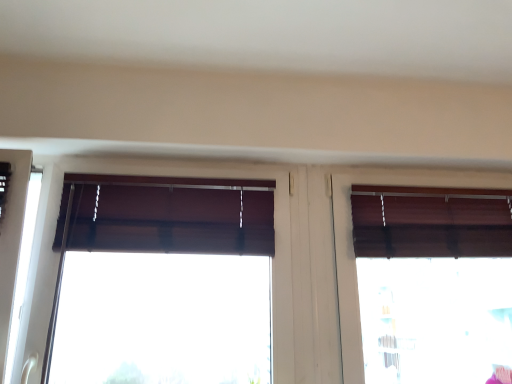
This screenshot has width=512, height=384. What do you see at coordinates (433, 282) in the screenshot?
I see `brown wooden blinds at right, which is the second window in left-to-right order` at bounding box center [433, 282].

Locate an element on the screen. The width and height of the screenshot is (512, 384). brown wooden blinds at right, which is the second window in left-to-right order is located at coordinates (433, 282).

The height and width of the screenshot is (384, 512). I want to click on brown fabric window at center, which is the 2th window in right-to-left order, so click(166, 215).

Image resolution: width=512 pixels, height=384 pixels. Describe the element at coordinates (166, 215) in the screenshot. I see `brown fabric window at center, which is the 2th window in right-to-left order` at that location.

Measure the distance between brown fabric window at center, which ranks as the first window in left-to-right order, and camera.

1.39 meters.

This screenshot has width=512, height=384. Identify the location of brown wooden blinds at right, which is the second window in left-to-right order. (433, 282).

Based on their positions, is brown wooden blinds at right, which is the 1th window from right to left, located to the left or right of brown fabric window at center, which ranks as the first window in left-to-right order?

brown wooden blinds at right, which is the 1th window from right to left, is positioned on brown fabric window at center, which ranks as the first window in left-to-right order,'s right side.

Does brown wooden blinds at right, which is the 1th window from right to left, lie in front of brown fabric window at center, which ranks as the first window in left-to-right order?

No.

Between point (426, 372) and point (88, 237), which one is positioned in front?

The point (88, 237) is closer.

From the image's perspective, is brown wooden blinds at right, which is the second window in left-to-right order, located beneath brown fabric window at center, which ranks as the first window in left-to-right order?

Yes, from the image's perspective, brown wooden blinds at right, which is the second window in left-to-right order, is beneath brown fabric window at center, which ranks as the first window in left-to-right order.

From a real-world perspective, is brown wooden blinds at right, which is the 1th window from right to left, over brown fabric window at center, which ranks as the first window in left-to-right order?

Incorrect, from a real-world perspective, brown wooden blinds at right, which is the 1th window from right to left, is lower than brown fabric window at center, which ranks as the first window in left-to-right order.

Which of these two, brown wooden blinds at right, which is the second window in left-to-right order, or brown fabric window at center, which ranks as the first window in left-to-right order, is thinner?

With smaller width is brown fabric window at center, which ranks as the first window in left-to-right order.

Considering the sizes of objects brown wooden blinds at right, which is the 1th window from right to left, and brown fabric window at center, which is the 2th window in right-to-left order, in the image provided, who is taller, brown wooden blinds at right, which is the 1th window from right to left, or brown fabric window at center, which is the 2th window in right-to-left order,?

brown wooden blinds at right, which is the 1th window from right to left.

Which of these two, brown wooden blinds at right, which is the second window in left-to-right order, or brown fabric window at center, which ranks as the first window in left-to-right order, is smaller?

brown wooden blinds at right, which is the second window in left-to-right order, is smaller.

Is brown wooden blinds at right, which is the 1th window from right to left, inside or outside of brown fabric window at center, which ranks as the first window in left-to-right order?

The correct answer is: outside.

Would you consider brown wooden blinds at right, which is the 1th window from right to left, to be distant from brown fabric window at center, which is the 2th window in right-to-left order?

That's not correct — brown wooden blinds at right, which is the 1th window from right to left, is a little close to brown fabric window at center, which is the 2th window in right-to-left order.

Is brown fabric window at center, which is the 2th window in right-to-left order, at the back of brown wooden blinds at right, which is the second window in left-to-right order?

That's not correct — brown wooden blinds at right, which is the second window in left-to-right order, is not looking away from brown fabric window at center, which is the 2th window in right-to-left order.

Can you tell me how much brown wooden blinds at right, which is the second window in left-to-right order, and brown fabric window at center, which ranks as the first window in left-to-right order, differ in facing direction?

There is a 0.00117-degree angle between the facing directions of brown wooden blinds at right, which is the second window in left-to-right order, and brown fabric window at center, which ranks as the first window in left-to-right order.

How distant is brown wooden blinds at right, which is the 1th window from right to left, from brown fabric window at center, which is the 2th window in right-to-left order?

26.45 inches.

The height and width of the screenshot is (384, 512). What are the coordinates of `window in front of the brown wooden blinds at right, which is the second window in left-to-right order` in the screenshot? It's located at (166, 215).

Based on their positions, is brown fabric window at center, which ranks as the first window in left-to-right order, located to the left or right of brown wooden blinds at right, which is the second window in left-to-right order?

brown fabric window at center, which ranks as the first window in left-to-right order, is to the left of brown wooden blinds at right, which is the second window in left-to-right order.

Does brown fabric window at center, which ranks as the first window in left-to-right order, lie behind brown wooden blinds at right, which is the second window in left-to-right order?

No, brown fabric window at center, which ranks as the first window in left-to-right order, is closer to the viewer.

Which is closer, (48, 347) or (444, 379)?

Point (48, 347) is closer to the camera than point (444, 379).

From the image's perspective, does brown fabric window at center, which ranks as the first window in left-to-right order, appear lower than brown wooden blinds at right, which is the second window in left-to-right order?

No, from the image's perspective, brown fabric window at center, which ranks as the first window in left-to-right order, is not beneath brown wooden blinds at right, which is the second window in left-to-right order.

From a real-world perspective, relative to brown wooden blinds at right, which is the 1th window from right to left, is brown fabric window at center, which is the 2th window in right-to-left order, vertically above or below?

Clearly, from a real-world perspective, brown fabric window at center, which is the 2th window in right-to-left order, is above brown wooden blinds at right, which is the 1th window from right to left.

Does brown fabric window at center, which ranks as the first window in left-to-right order, have a lesser width compared to brown wooden blinds at right, which is the second window in left-to-right order?

Yes.

Does brown fabric window at center, which is the 2th window in right-to-left order, have a greater height compared to brown wooden blinds at right, which is the second window in left-to-right order?

In fact, brown fabric window at center, which is the 2th window in right-to-left order, may be shorter than brown wooden blinds at right, which is the second window in left-to-right order.

Which of these two, brown fabric window at center, which ranks as the first window in left-to-right order, or brown wooden blinds at right, which is the 1th window from right to left, is bigger?

brown fabric window at center, which ranks as the first window in left-to-right order, is bigger.

Would you say brown fabric window at center, which ranks as the first window in left-to-right order, is outside brown wooden blinds at right, which is the second window in left-to-right order?

brown fabric window at center, which ranks as the first window in left-to-right order, lies outside brown wooden blinds at right, which is the second window in left-to-right order,'s area.

Are brown fabric window at center, which ranks as the first window in left-to-right order, and brown wooden blinds at right, which is the second window in left-to-right order, making contact?

No, brown fabric window at center, which ranks as the first window in left-to-right order, is not with brown wooden blinds at right, which is the second window in left-to-right order.

Is brown fabric window at center, which is the 2th window in right-to-left order, oriented towards brown wooden blinds at right, which is the 1th window from right to left?

No, brown fabric window at center, which is the 2th window in right-to-left order, is not facing towards brown wooden blinds at right, which is the 1th window from right to left.

How many degrees apart are the facing directions of brown fabric window at center, which is the 2th window in right-to-left order, and brown wooden blinds at right, which is the second window in left-to-right order?

The facing directions of brown fabric window at center, which is the 2th window in right-to-left order, and brown wooden blinds at right, which is the second window in left-to-right order, are 0.00117 degrees apart.

Could you measure the distance between brown fabric window at center, which ranks as the first window in left-to-right order, and brown wooden blinds at right, which is the second window in left-to-right order?

The distance of brown fabric window at center, which ranks as the first window in left-to-right order, from brown wooden blinds at right, which is the second window in left-to-right order, is 26.45 inches.

Locate an element on the screen. Image resolution: width=512 pixels, height=384 pixels. window on the left of brown wooden blinds at right, which is the second window in left-to-right order is located at coordinates (166, 215).

What are the coordinates of `window below the brown fabric window at center, which ranks as the first window in left-to-right order (from a real-world perspective)` in the screenshot? It's located at (433, 282).

Find the location of a particular element. window to the right of brown fabric window at center, which is the 2th window in right-to-left order is located at coordinates (433, 282).